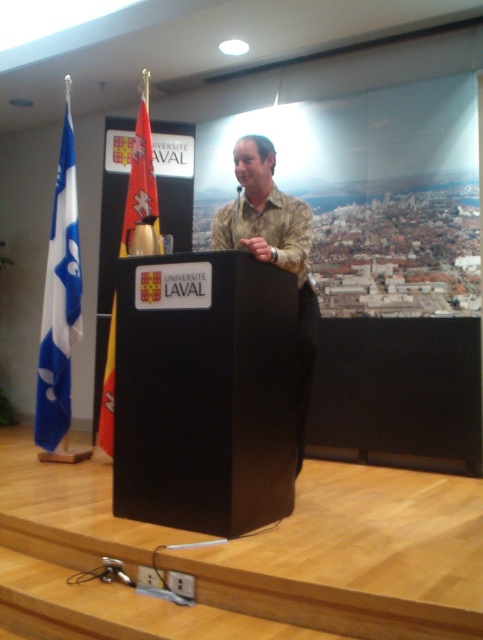
Between blue fabric flag at left and red fabric flag at left, which one appears on the right side from the viewer's perspective?

From the viewer's perspective, red fabric flag at left appears more on the right side.

Does blue fabric flag at left appear on the left side of red fabric flag at left?

Correct, you'll find blue fabric flag at left to the left of red fabric flag at left.

Is point (42, 332) less distant than point (137, 225)?

No, it is behind (137, 225).

You are a GUI agent. You are given a task and a screenshot of the screen. Output one action in this format:
    pyautogui.click(x=<x>, y=<y>)
    Task: Click on the blue fabric flag at left
    This screenshot has width=483, height=640.
    Given the screenshot: What is the action you would take?
    pyautogui.click(x=59, y=307)

Is camouflage shirt at center smaller than blue fabric flag at left?

No, camouflage shirt at center is not smaller than blue fabric flag at left.

Can you confirm if camouflage shirt at center is positioned to the right of blue fabric flag at left?

Indeed, camouflage shirt at center is positioned on the right side of blue fabric flag at left.

Is point (278, 205) in front of point (65, 323)?

That is True.

Where is `camouflage shirt at center`? The height and width of the screenshot is (640, 483). camouflage shirt at center is located at coordinates (273, 250).

Does camouflage shirt at center have a greater height compared to red fabric flag at left?

Correct, camouflage shirt at center is much taller as red fabric flag at left.

What do you see at coordinates (273, 250) in the screenshot?
I see `camouflage shirt at center` at bounding box center [273, 250].

Locate an element on the screen. camouflage shirt at center is located at coordinates (273, 250).